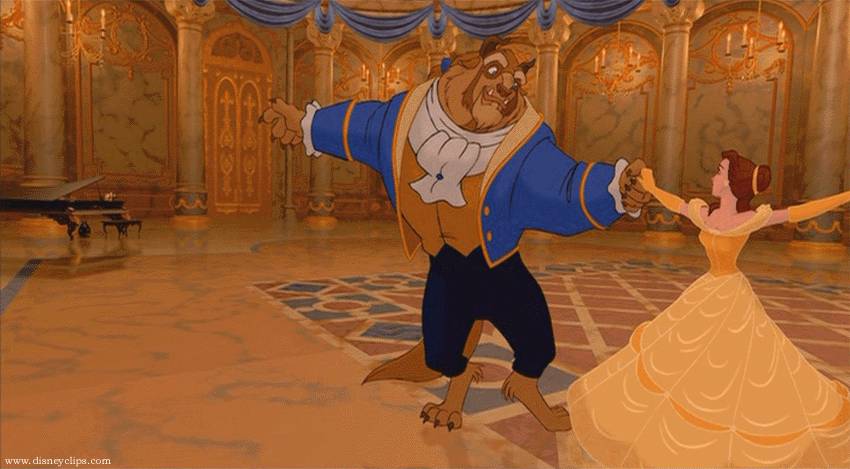
This screenshot has width=850, height=469. Find the location of `chandeliers`. chandeliers is located at coordinates (80, 40), (383, 85), (616, 77), (749, 69).